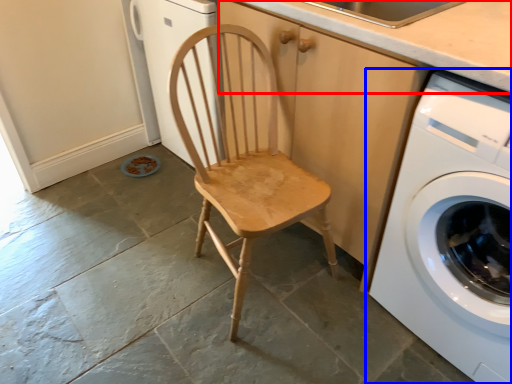
Question: Which object is closer to the camera taking this photo, counter top (highlighted by a red box) or washing machine (highlighted by a blue box)?

Choices:
 (A) counter top
 (B) washing machine

Answer: (B)